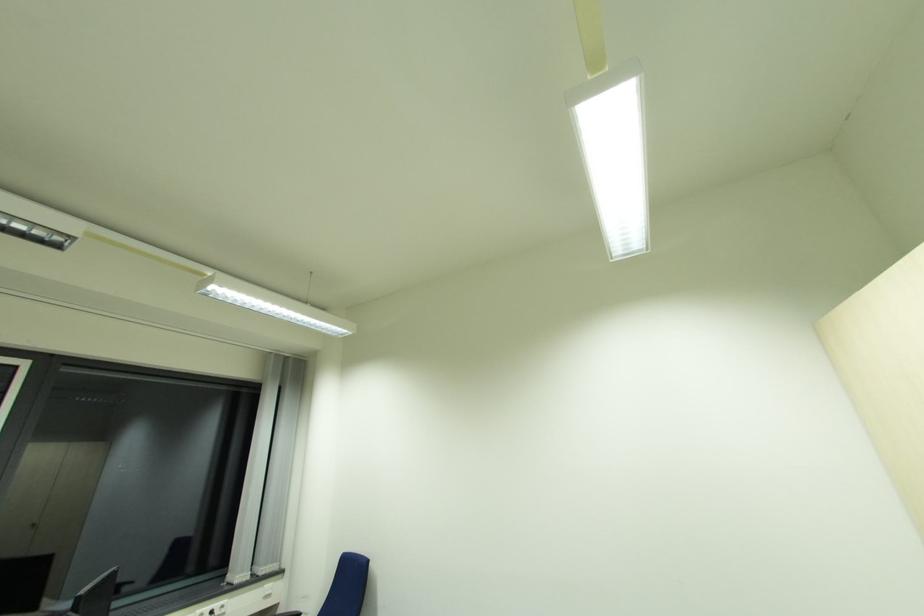
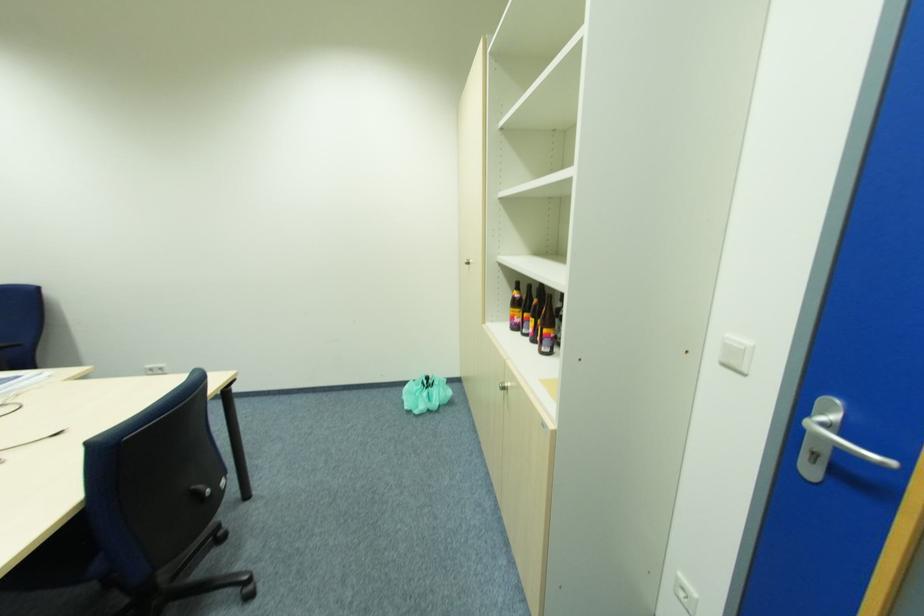
From the picture: First-person continuous shooting, in which direction is the camera rotating?

The camera's rotation is toward right-down.